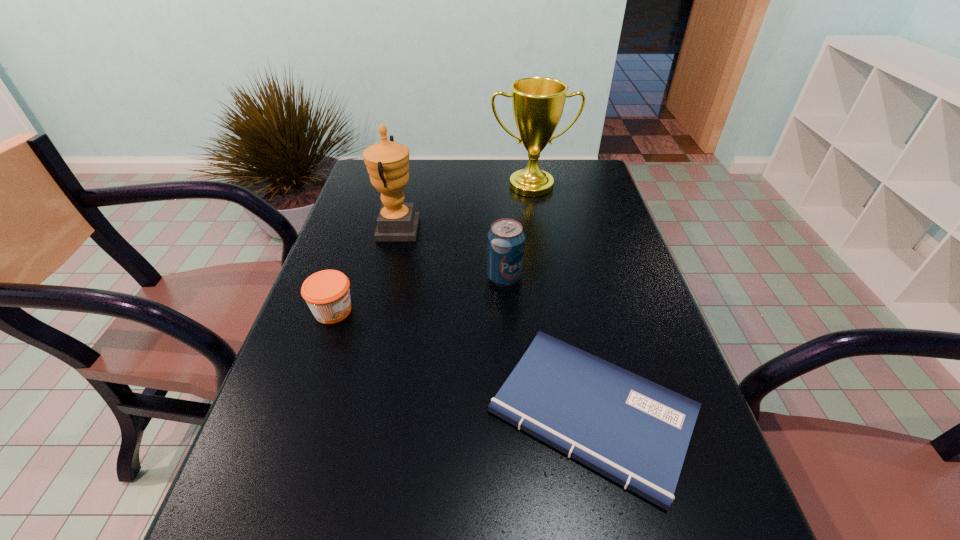
Find the location of a particular element. the right award is located at coordinates (537, 102).

The width and height of the screenshot is (960, 540). I want to click on the farthest object, so click(x=537, y=102).

Locate an element on the screen. the fourth nearest object is located at coordinates (387, 162).

I want to click on the left award, so click(x=387, y=162).

Where is `pop soda`? The width and height of the screenshot is (960, 540). pop soda is located at coordinates (506, 239).

I want to click on the third nearest object, so click(x=506, y=239).

I want to click on jam, so click(327, 293).

Identify the location of the fourth tallest object. (327, 293).

The width and height of the screenshot is (960, 540). I want to click on the nearest object, so click(x=636, y=432).

You are a GUI agent. You are given a task and a screenshot of the screen. Output one action in this format:
    pyautogui.click(x=<x>, y=<y>)
    Task: Click on the paperback book
    Image resolution: width=960 pixels, height=540 pixels.
    Given the screenshot: What is the action you would take?
    pyautogui.click(x=636, y=432)